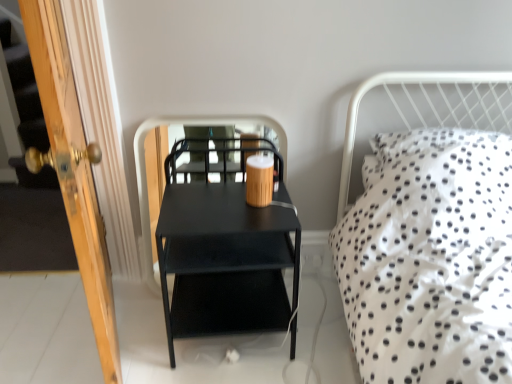
Question: Can you confirm if black matte side table at center is wider than wooden door at left?

Choices:
 (A) no
 (B) yes

Answer: (A)

Question: Is black matte side table at center outside wooden door at left?

Choices:
 (A) yes
 (B) no

Answer: (A)

Question: Is black matte side table at center far from wooden door at left?

Choices:
 (A) yes
 (B) no

Answer: (B)

Question: Does black matte side table at center come behind wooden door at left?

Choices:
 (A) no
 (B) yes

Answer: (B)

Question: Is black matte side table at center bigger than wooden door at left?

Choices:
 (A) yes
 (B) no

Answer: (B)

Question: Is black matte side table at center taller than wooden door at left?

Choices:
 (A) no
 (B) yes

Answer: (A)

Question: Is matte black nightstand at center thinner than black matte side table at center?

Choices:
 (A) no
 (B) yes

Answer: (A)

Question: Is black matte side table at center at the back of matte black nightstand at center?

Choices:
 (A) yes
 (B) no

Answer: (A)

Question: Can you confirm if matte black nightstand at center is smaller than black matte side table at center?

Choices:
 (A) no
 (B) yes

Answer: (A)

Question: Does matte black nightstand at center appear on the left side of black matte side table at center?

Choices:
 (A) no
 (B) yes

Answer: (A)

Question: From a real-world perspective, is matte black nightstand at center located beneath black matte side table at center?

Choices:
 (A) yes
 (B) no

Answer: (A)

Question: Is matte black nightstand at center closer to camera compared to black matte side table at center?

Choices:
 (A) no
 (B) yes

Answer: (B)

Question: Are wooden door at left and wooden coffee cup at center far apart?

Choices:
 (A) yes
 (B) no

Answer: (B)